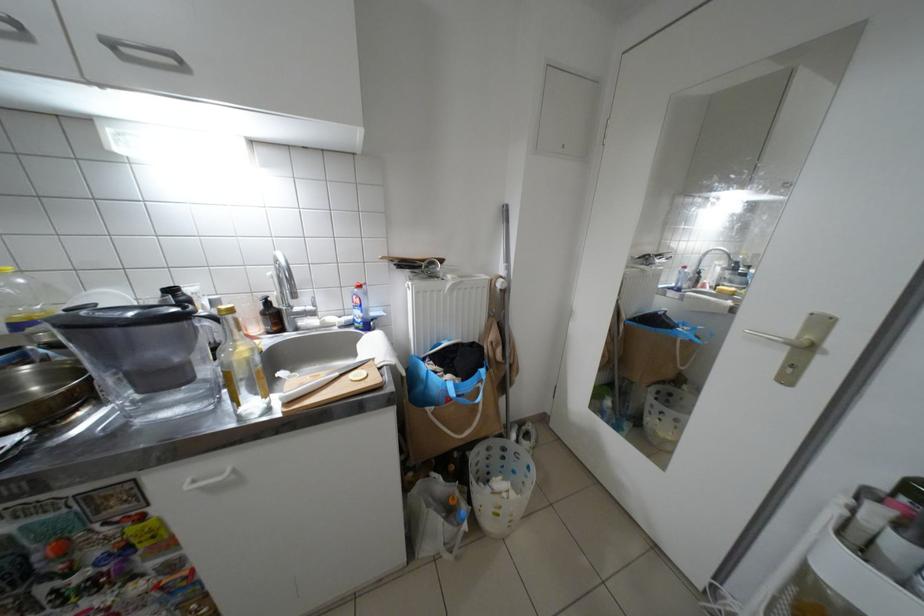
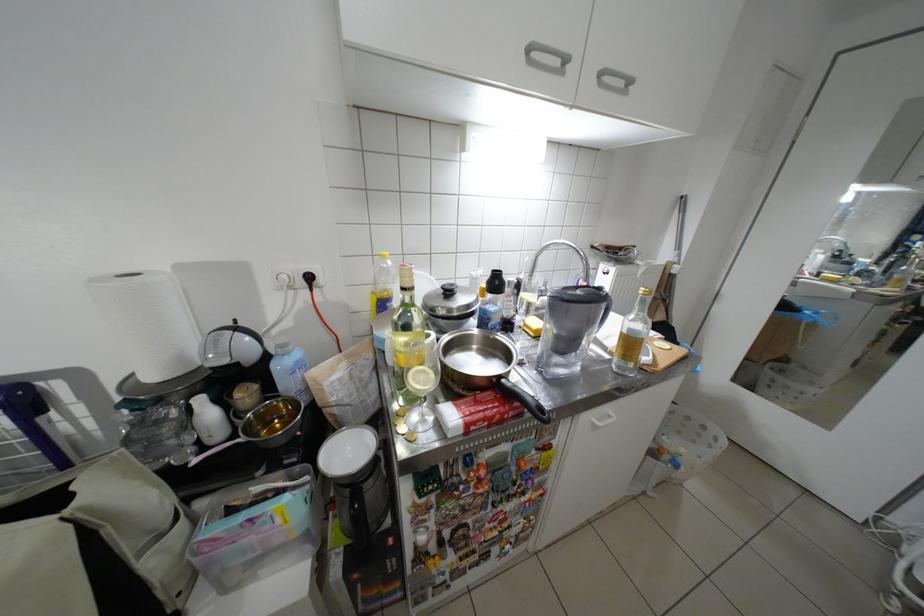
Where in the second image is the point corresponding to the point at 33,281 from the first image?

(400, 264)